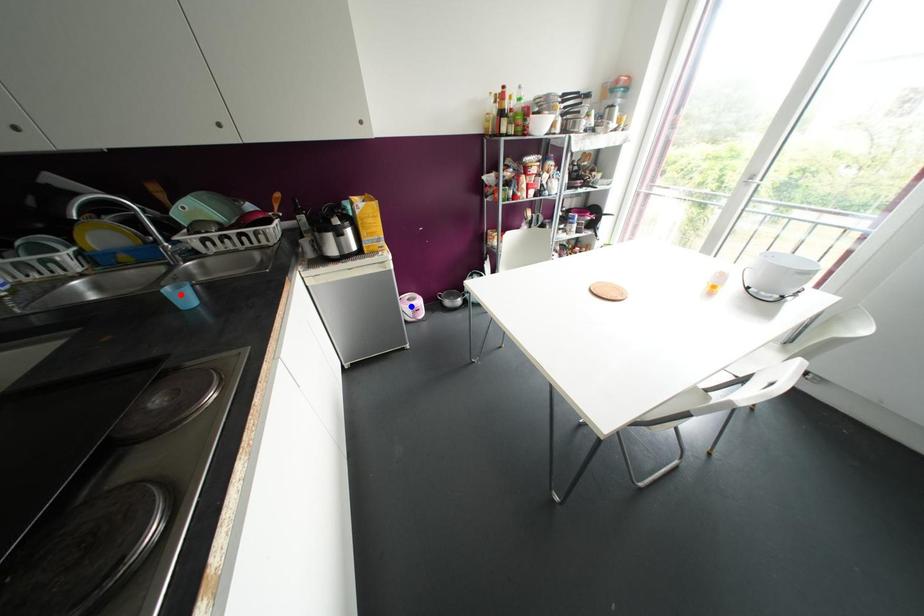
Question: In the image, two points are highlighted. Which point is nearer to the camera? Reply with the corresponding letter.

Choices:
 (A) blue point
 (B) red point

Answer: (B)